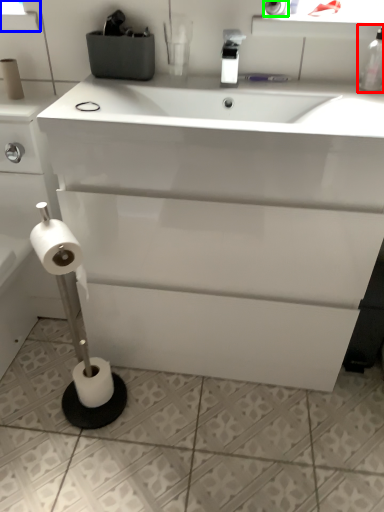
Question: Considering the real-world distances, which object is closest to bottle (highlighted by a red box)? window screen (highlighted by a blue box) or toilet paper (highlighted by a green box).

Choices:
 (A) window screen
 (B) toilet paper

Answer: (B)